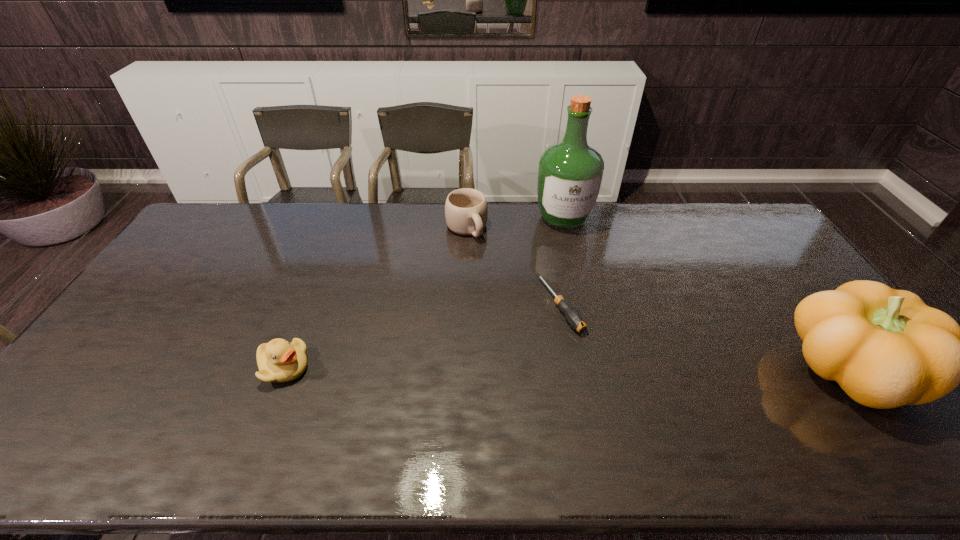
I want to click on the leftmost object, so click(x=278, y=360).

Locate an element on the screen. This screenshot has width=960, height=540. the rightmost object is located at coordinates (886, 348).

Locate an element on the screen. The height and width of the screenshot is (540, 960). the second tallest object is located at coordinates (886, 348).

At what (x,y) coordinates should I click in order to perform the action: click on the shortest object. Please return your answer as a coordinate pair (x, y). Looking at the image, I should click on (573, 317).

Locate an element on the screen. mug is located at coordinates [466, 210].

Locate an element on the screen. liquor is located at coordinates (570, 175).

At what (x,y) coordinates should I click in order to perform the action: click on free space located on the beak of the duckling. Please return your answer as a coordinate pair (x, y). This screenshot has width=960, height=540. Looking at the image, I should click on (339, 368).

This screenshot has height=540, width=960. Find the location of `vacant space located on the back of the fourth shortest object`. vacant space located on the back of the fourth shortest object is located at coordinates (765, 256).

The height and width of the screenshot is (540, 960). I want to click on free space located at the tip of the shortest object, so click(617, 388).

You are a GUI agent. You are given a task and a screenshot of the screen. Output one action in this format:
    pyautogui.click(x=<x>, y=<y>)
    Task: Click on the vacant area located 0.160m at the tip of the shortest object
    This screenshot has height=540, width=960.
    Given the screenshot: What is the action you would take?
    pyautogui.click(x=608, y=376)